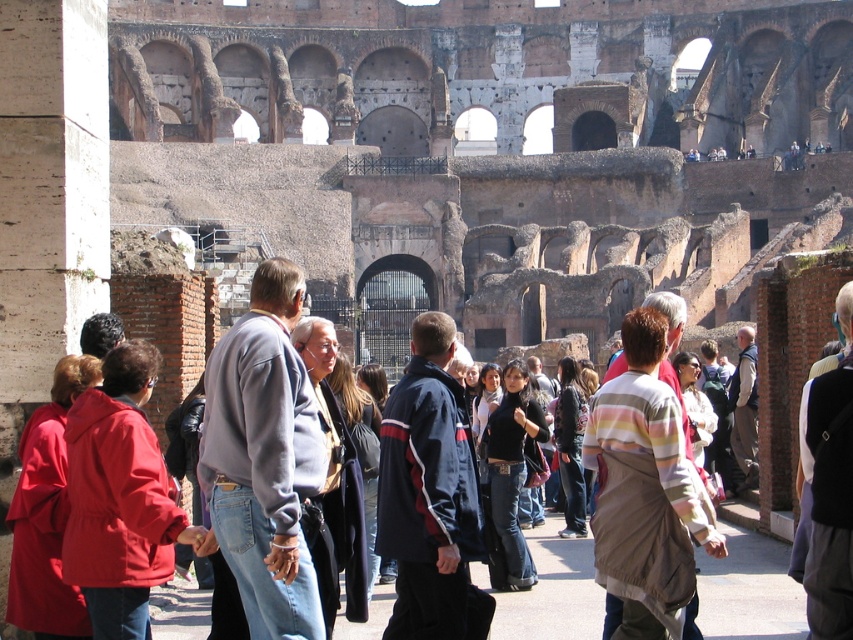
Question: Is striped cotton shirt at center bigger than dark gray sweater at center?

Choices:
 (A) yes
 (B) no

Answer: (B)

Question: Can you confirm if dark gray sweater at center is smaller than black leather jacket at center?

Choices:
 (A) yes
 (B) no

Answer: (B)

Question: Which is nearer to the matte red coat at lower left?

Choices:
 (A) denim jacket at center
 (B) black leather jacket at center

Answer: (B)

Question: Estimate the real-world distances between objects in this image. Which object is closer to the dark gray sweater at center?

Choices:
 (A) white cotton shirt at center
 (B) matte red jacket at lower left

Answer: (B)

Question: Is striped cotton shirt at center wider than dark gray sweater at center?

Choices:
 (A) yes
 (B) no

Answer: (A)

Question: Among these objects, which one is farthest from the camera?

Choices:
 (A) denim jacket at center
 (B) dark gray sweater at center
 (C) matte red coat at lower left

Answer: (A)